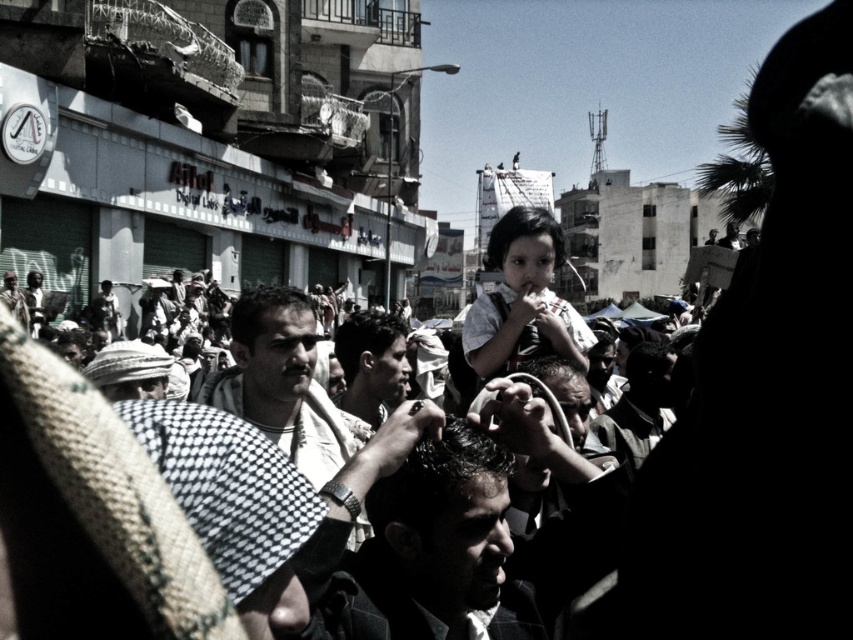
What do you see at coordinates (422, 552) in the screenshot?
I see `dark brown hair at center` at bounding box center [422, 552].

Between dark brown hair at center and checkered fabric headscarf at center, which one has more height?

checkered fabric headscarf at center

Identify the location of dark brown hair at center. click(422, 552).

Can you confirm if smooth skin face at center is positioned below dark brown leather jacket at center?

No.

In the scene shown: Which of these two, smooth skin face at center or dark brown leather jacket at center, stands taller?

dark brown leather jacket at center

Is point (373, 384) positioned after point (633, 348)?

No, (373, 384) is in front of (633, 348).

The image size is (853, 640). I want to click on smooth skin face at center, so click(370, 364).

Which is more to the left, checkered fabric headscarf at center or smooth skin face at center?

Positioned to the left is checkered fabric headscarf at center.

Is checkered fabric headscarf at center below smooth skin face at center?

Yes, checkered fabric headscarf at center is below smooth skin face at center.

Is point (311, 340) farther from camera compared to point (363, 321)?

That is False.

At what (x,y) coordinates should I click in order to perform the action: click on checkered fabric headscarf at center. Please return your answer as a coordinate pair (x, y). The image size is (853, 640). Looking at the image, I should click on (281, 381).